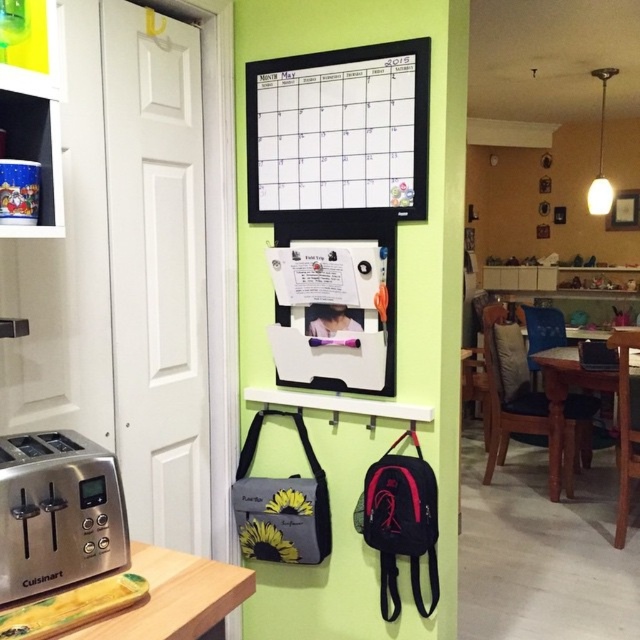
Does wooden table at lower left lie behind brown wooden table at center?

No.

In the scene shown: Which is more to the left, wooden table at lower left or brown wooden table at center?

wooden table at lower left

Between point (179, 577) and point (556, 458), which one is positioned behind?

The point (556, 458) is behind.

Identify the location of wooden table at lower left. (177, 596).

Is stainless steel toaster at left shorter than brown wooden table at center?

Correct, stainless steel toaster at left is not as tall as brown wooden table at center.

Is stainless steel toaster at left below brown wooden table at center?

No, stainless steel toaster at left is not below brown wooden table at center.

Identify the location of stainless steel toaster at left. (58, 513).

Can you confirm if stainless steel toaster at left is taller than wooden table at lower left?

Correct, stainless steel toaster at left is much taller as wooden table at lower left.

Does point (38, 538) come in front of point (140, 634)?

No, (38, 538) is further to viewer.

Which is behind, point (54, 552) or point (170, 604)?

The point (170, 604) is behind.

This screenshot has width=640, height=640. I want to click on stainless steel toaster at left, so click(x=58, y=513).